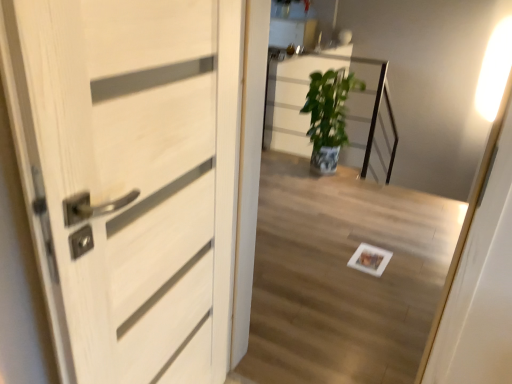
Question: Considering the relative sizes of white glossy light at upper right and white wood door at left in the image provided, is white glossy light at upper right taller than white wood door at left?

Choices:
 (A) yes
 (B) no

Answer: (B)

Question: Does white glossy light at upper right appear on the right side of white wood door at left?

Choices:
 (A) yes
 (B) no

Answer: (A)

Question: Would you say white glossy light at upper right is outside white wood door at left?

Choices:
 (A) yes
 (B) no

Answer: (A)

Question: Is white glossy light at upper right next to white wood door at left?

Choices:
 (A) yes
 (B) no

Answer: (B)

Question: Is white glossy light at upper right positioned before white wood door at left?

Choices:
 (A) yes
 (B) no

Answer: (B)

Question: Looking at the image, does white glossy light at upper right seem bigger or smaller compared to green glossy plant at center?

Choices:
 (A) small
 (B) big

Answer: (A)

Question: Visually, is white glossy light at upper right positioned to the left or to the right of green glossy plant at center?

Choices:
 (A) right
 (B) left

Answer: (A)

Question: Is white glossy light at upper right inside or outside of green glossy plant at center?

Choices:
 (A) inside
 (B) outside

Answer: (B)

Question: From the image's perspective, relative to green glossy plant at center, is white glossy light at upper right above or below?

Choices:
 (A) below
 (B) above

Answer: (B)

Question: Is white wood door at left spatially inside white glossy light at upper right, or outside of it?

Choices:
 (A) outside
 (B) inside

Answer: (A)

Question: Relative to white glossy light at upper right, is white wood door at left in front or behind?

Choices:
 (A) front
 (B) behind

Answer: (A)

Question: From their relative heights in the image, would you say white wood door at left is taller or shorter than white glossy light at upper right?

Choices:
 (A) tall
 (B) short

Answer: (A)

Question: Considering the positions of white wood door at left and white glossy light at upper right in the image, is white wood door at left wider or thinner than white glossy light at upper right?

Choices:
 (A) thin
 (B) wide

Answer: (B)

Question: Looking at the image, does green glossy plant at center seem bigger or smaller compared to white glossy light at upper right?

Choices:
 (A) small
 (B) big

Answer: (B)

Question: Would you say green glossy plant at center is inside or outside white glossy light at upper right?

Choices:
 (A) outside
 (B) inside

Answer: (A)